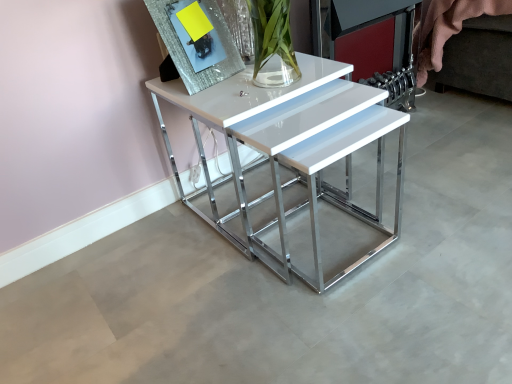
Identify the location of free space to the left of white glossy table at center. The height and width of the screenshot is (384, 512). (136, 268).